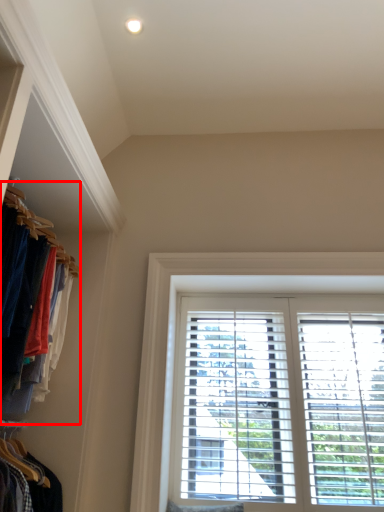
Question: Observing the image, what is the correct spatial positioning of closet (annotated by the red box) in reference to window?

Choices:
 (A) left
 (B) right

Answer: (A)